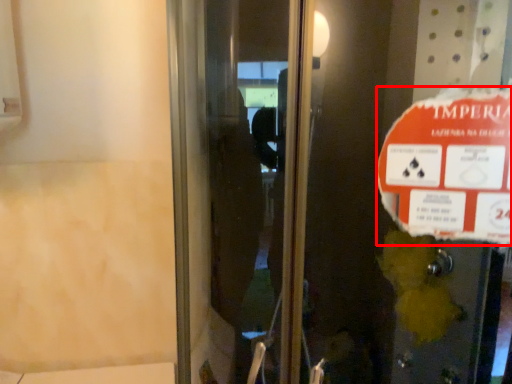
Question: From the image's perspective, where is street sign (annotated by the red box) located in relation to elevator door in the image?

Choices:
 (A) above
 (B) below

Answer: (A)